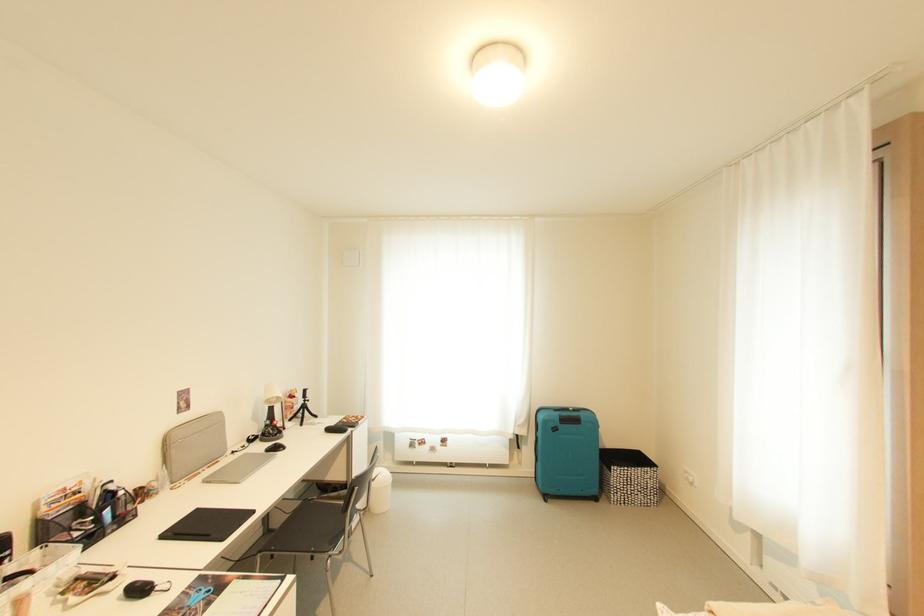
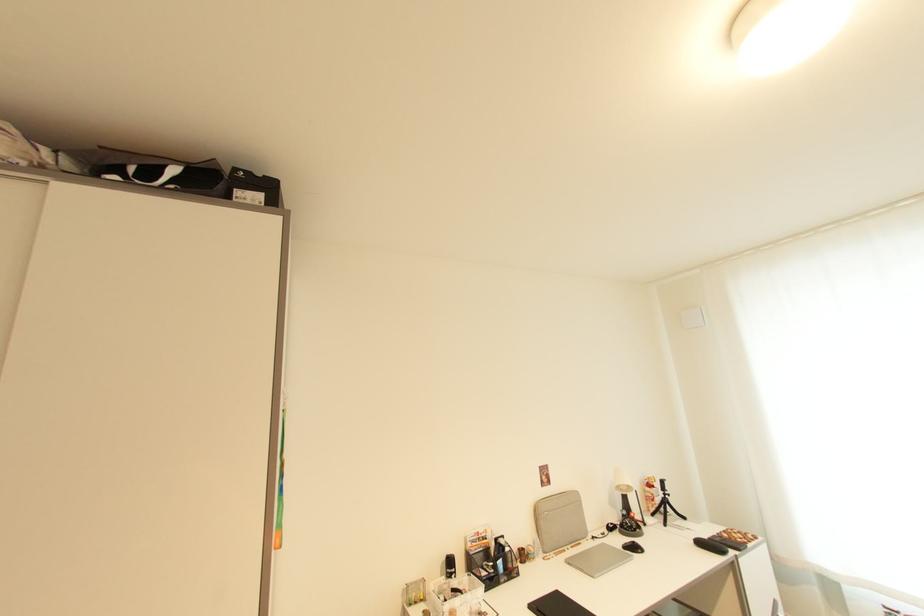
Locate, in the second image, the point that corresponds to (x=280, y=402) in the first image.

(629, 490)